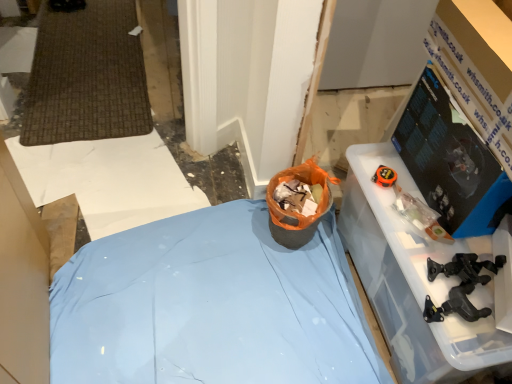
This screenshot has height=384, width=512. I want to click on free space above transparent plastic container at right, arranged as the 2th furniture when viewed from the left (from a real-world perspective), so click(x=434, y=227).